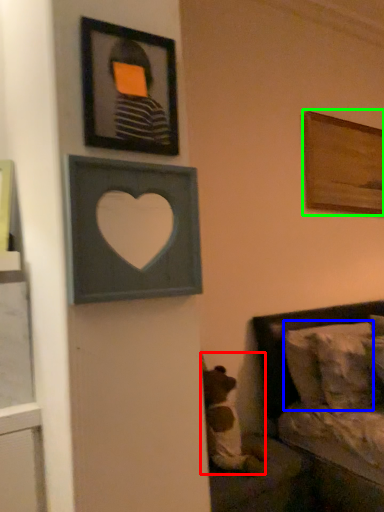
Question: Which object is positioned farthest from animal (highlighted by a red box)? Select from pillow (highlighted by a blue box) and picture frame (highlighted by a green box).

Choices:
 (A) pillow
 (B) picture frame

Answer: (B)